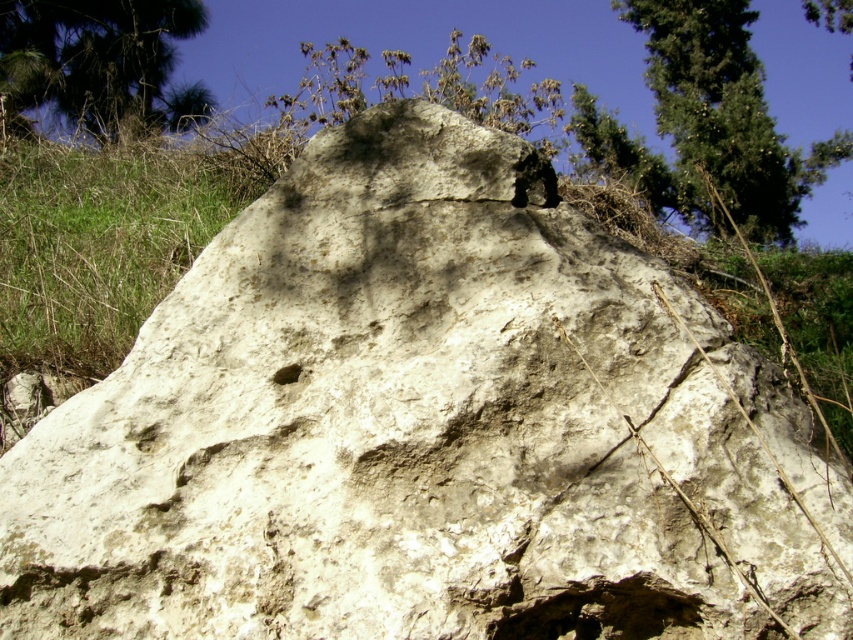
Based on the photo, does green leafy tree at upper right have a smaller size compared to green leafy tree at upper left?

Actually, green leafy tree at upper right might be larger than green leafy tree at upper left.

Looking at this image, does green leafy tree at upper right have a lesser height compared to green leafy tree at upper left?

Incorrect, green leafy tree at upper right's height does not fall short of green leafy tree at upper left's.

Is point (648, 54) closer to viewer compared to point (209, 109)?

No, (648, 54) is behind (209, 109).

I want to click on green leafy tree at upper right, so click(x=723, y=116).